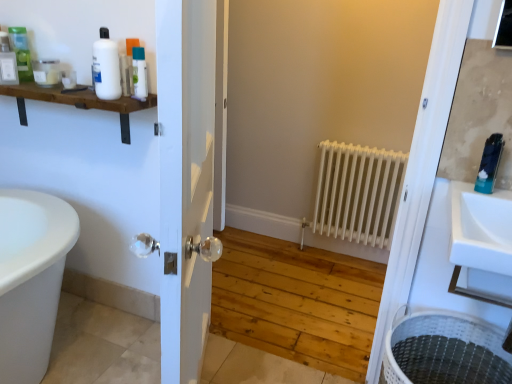
Question: Considering the relative positions of matte green bottle at upper left, marked as the second toiletry in a left-to-right arrangement, and matte white bottle at upper left, marked as the 1th toiletry in a left-to-right arrangement, in the image provided, is matte green bottle at upper left, marked as the second toiletry in a left-to-right arrangement, to the right of matte white bottle at upper left, marked as the 1th toiletry in a left-to-right arrangement, from the viewer's perspective?

Choices:
 (A) yes
 (B) no

Answer: (A)

Question: Considering the relative positions of matte green bottle at upper left, which appears as the sixth toiletry when viewed from the right, and matte white bottle at upper left, which ranks as the seventh toiletry in right-to-left order, in the image provided, is matte green bottle at upper left, which appears as the sixth toiletry when viewed from the right, in front of matte white bottle at upper left, which ranks as the seventh toiletry in right-to-left order,?

Choices:
 (A) no
 (B) yes

Answer: (B)

Question: Does matte green bottle at upper left, which appears as the sixth toiletry when viewed from the right, have a lesser height compared to matte white bottle at upper left, marked as the 1th toiletry in a left-to-right arrangement?

Choices:
 (A) no
 (B) yes

Answer: (A)

Question: Is matte green bottle at upper left, which appears as the sixth toiletry when viewed from the right, completely or partially outside of matte white bottle at upper left, which ranks as the seventh toiletry in right-to-left order?

Choices:
 (A) no
 (B) yes

Answer: (B)

Question: Is matte green bottle at upper left, marked as the second toiletry in a left-to-right arrangement, oriented away from matte white bottle at upper left, marked as the 1th toiletry in a left-to-right arrangement?

Choices:
 (A) no
 (B) yes

Answer: (A)

Question: Is matte green bottle at upper left, which appears as the sixth toiletry when viewed from the right, smaller than matte white bottle at upper left, marked as the 1th toiletry in a left-to-right arrangement?

Choices:
 (A) no
 (B) yes

Answer: (A)

Question: Does translucent plastic bottle at upper left, the 2th toiletry from the right, lie in front of blue glossy toothpaste tube at upper right, the 1th toiletry viewed from the right?

Choices:
 (A) no
 (B) yes

Answer: (A)

Question: Is translucent plastic bottle at upper left, the 2th toiletry from the right, far away from blue glossy toothpaste tube at upper right, which is the 7th toiletry from left to right?

Choices:
 (A) no
 (B) yes

Answer: (B)

Question: Is blue glossy toothpaste tube at upper right, the 1th toiletry viewed from the right, at the back of translucent plastic bottle at upper left, the 2th toiletry from the right?

Choices:
 (A) no
 (B) yes

Answer: (A)

Question: Considering the relative sizes of translucent plastic bottle at upper left, which is the sixth toiletry from left to right, and blue glossy toothpaste tube at upper right, the 1th toiletry viewed from the right, in the image provided, is translucent plastic bottle at upper left, which is the sixth toiletry from left to right, shorter than blue glossy toothpaste tube at upper right, the 1th toiletry viewed from the right,?

Choices:
 (A) yes
 (B) no

Answer: (A)

Question: Does translucent plastic bottle at upper left, which is the sixth toiletry from left to right, come behind blue glossy toothpaste tube at upper right, which is the 7th toiletry from left to right?

Choices:
 (A) no
 (B) yes

Answer: (B)

Question: From a real-world perspective, is translucent plastic bottle at upper left, which is the sixth toiletry from left to right, physically below blue glossy toothpaste tube at upper right, the 1th toiletry viewed from the right?

Choices:
 (A) yes
 (B) no

Answer: (B)

Question: Is matte white jar at upper left, which ranks as the 5th toiletry in right-to-left order, thinner than white matte radiator at center?

Choices:
 (A) no
 (B) yes

Answer: (A)